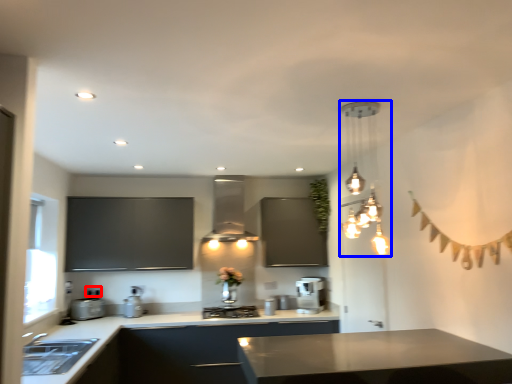
Question: Which point is closer to the camera, electric outlet (highlighted by a red box) or lamp (highlighted by a blue box)?

Choices:
 (A) electric outlet
 (B) lamp

Answer: (B)